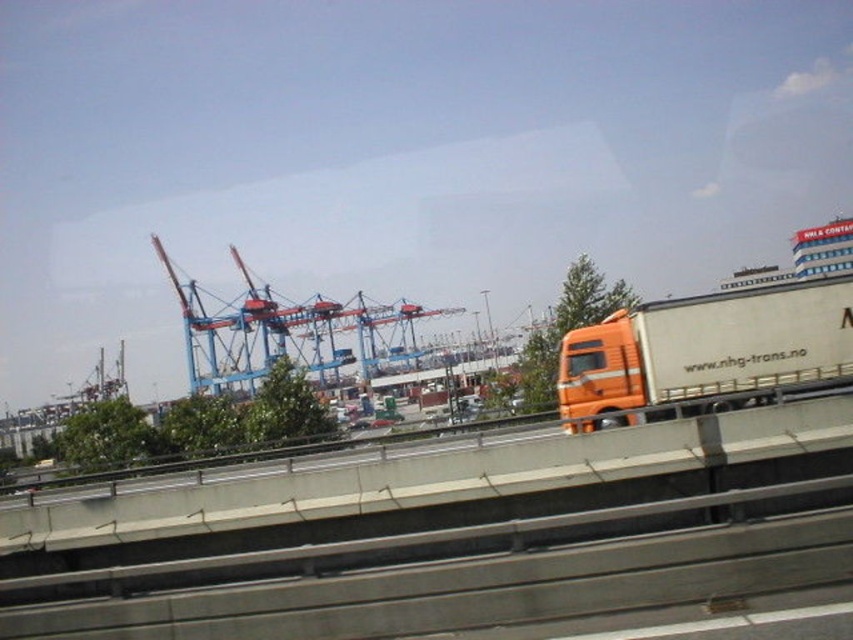
Does concrete at center have a lesser width compared to orange matte trailer truck at right?

In fact, concrete at center might be wider than orange matte trailer truck at right.

In the scene shown: How much distance is there between concrete at center and orange matte trailer truck at right?

The distance of concrete at center from orange matte trailer truck at right is 33.87 feet.

Describe the element at coordinates (434, 477) in the screenshot. This screenshot has width=853, height=640. I see `concrete at center` at that location.

Identify the location of concrete at center. Image resolution: width=853 pixels, height=640 pixels. (434, 477).